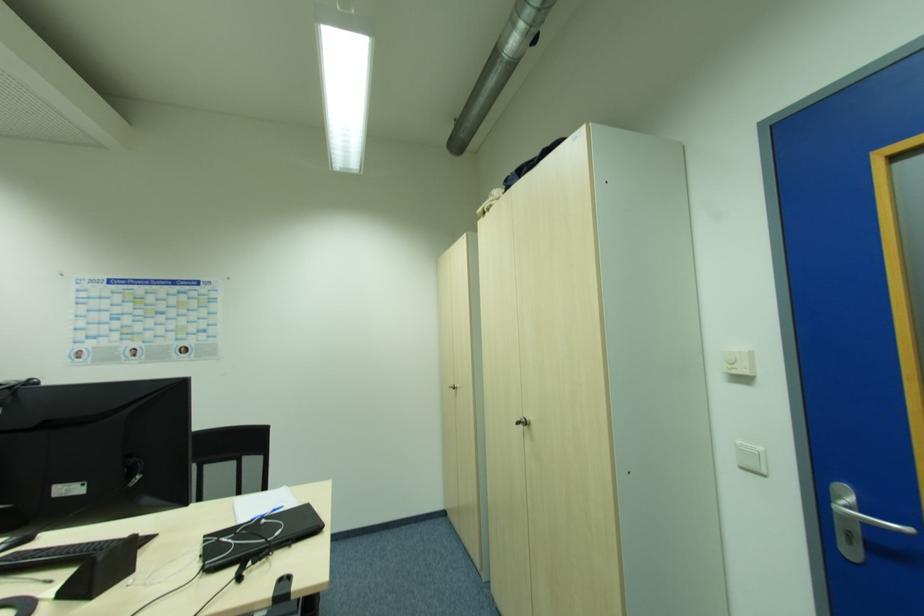
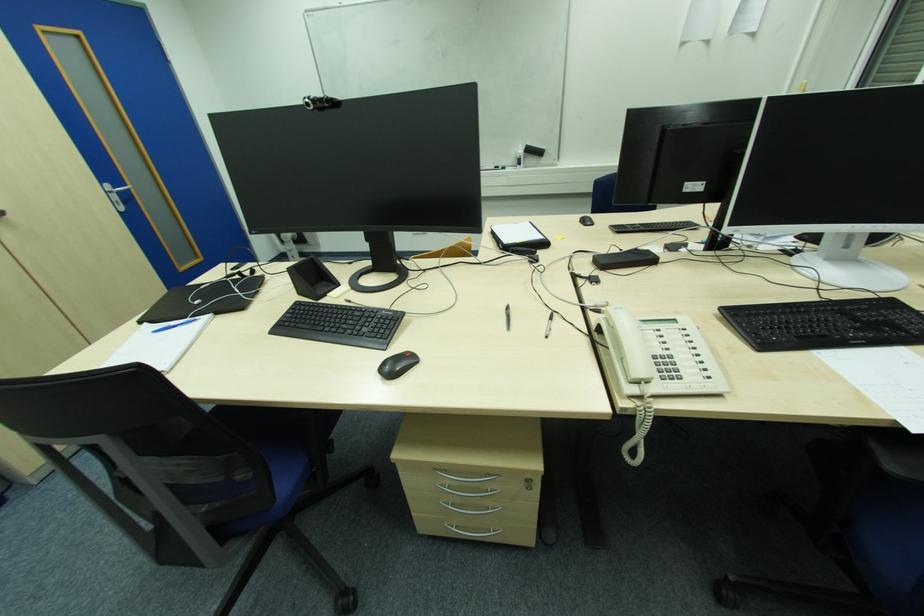
The point at (852,537) is marked in the first image. Where is the corresponding point in the second image?

(119, 204)